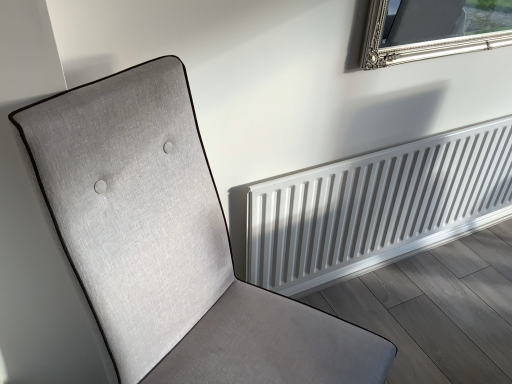
What do you see at coordinates (170, 245) in the screenshot?
I see `textured fabric chair at left` at bounding box center [170, 245].

This screenshot has height=384, width=512. Identify the location of textured fabric chair at left. (170, 245).

I want to click on white metallic radiator at lower right, so click(x=377, y=207).

Describe the element at coordinates (377, 207) in the screenshot. I see `white metallic radiator at lower right` at that location.

What are the coordinates of `textured fabric chair at left` in the screenshot? It's located at (170, 245).

Which is more to the left, white metallic radiator at lower right or textured fabric chair at left?

Positioned to the left is textured fabric chair at left.

Is white metallic radiator at lower right in front of or behind textured fabric chair at left in the image?

white metallic radiator at lower right is positioned farther from the viewer than textured fabric chair at left.

Considering the points (463, 161) and (234, 335), which point is behind, point (463, 161) or point (234, 335)?

The point (463, 161) is behind.

From the image's perspective, does white metallic radiator at lower right appear lower than textured fabric chair at left?

Incorrect, from the image's perspective, white metallic radiator at lower right is higher than textured fabric chair at left.

From a real-world perspective, is white metallic radiator at lower right positioned above or below textured fabric chair at left?

From a real-world perspective, white metallic radiator at lower right is physically below textured fabric chair at left.

Is white metallic radiator at lower right wider or thinner than textured fabric chair at left?

Clearly, white metallic radiator at lower right has less width compared to textured fabric chair at left.

In terms of height, does white metallic radiator at lower right look taller or shorter compared to textured fabric chair at left?

white metallic radiator at lower right is shorter than textured fabric chair at left.

In terms of size, does white metallic radiator at lower right appear bigger or smaller than textured fabric chair at left?

Clearly, white metallic radiator at lower right is smaller in size than textured fabric chair at left.

Would you say white metallic radiator at lower right is inside or outside textured fabric chair at left?

white metallic radiator at lower right is located beyond the bounds of textured fabric chair at left.

Is white metallic radiator at lower right beside textured fabric chair at left?

No, white metallic radiator at lower right is not in contact with textured fabric chair at left.

Is textured fabric chair at left at the back of white metallic radiator at lower right?

That's not correct — white metallic radiator at lower right is not looking away from textured fabric chair at left.

What's the angular difference between white metallic radiator at lower right and textured fabric chair at left's facing directions?

30.9 degrees separate the facing orientations of white metallic radiator at lower right and textured fabric chair at left.

Find the location of `furniture in front of the white metallic radiator at lower right`. furniture in front of the white metallic radiator at lower right is located at coordinates (170, 245).

Visually, is textured fabric chair at left positioned to the left or to the right of white metallic radiator at lower right?

textured fabric chair at left is positioned on white metallic radiator at lower right's left side.

Is textured fabric chair at left positioned before white metallic radiator at lower right?

Yes, it is in front of white metallic radiator at lower right.

Which is closer to the camera, [72,145] or [401,198]?

Point [72,145] is closer to the camera than point [401,198].

From the image's perspective, would you say textured fabric chair at left is positioned over white metallic radiator at lower right?

Incorrect, from the image's perspective, textured fabric chair at left is lower than white metallic radiator at lower right.

From a real-world perspective, is textured fabric chair at left positioned above or below white metallic radiator at lower right?

In terms of real-world spatial position, textured fabric chair at left is above white metallic radiator at lower right.

Considering the sizes of textured fabric chair at left and white metallic radiator at lower right in the image, is textured fabric chair at left wider or thinner than white metallic radiator at lower right?

textured fabric chair at left is wider than white metallic radiator at lower right.

Is textured fabric chair at left shorter than white metallic radiator at lower right?

No.

Does textured fabric chair at left have a larger size compared to white metallic radiator at lower right?

Indeed, textured fabric chair at left has a larger size compared to white metallic radiator at lower right.

Is white metallic radiator at lower right located within textured fabric chair at left?

Answer: No.

Is textured fabric chair at left placed right next to white metallic radiator at lower right?

No, textured fabric chair at left is not next to white metallic radiator at lower right.

Is textured fabric chair at left oriented towards white metallic radiator at lower right?

No, textured fabric chair at left is not aimed at white metallic radiator at lower right.

Identify the location of radiator on the right of textured fabric chair at left. click(377, 207).

Identify the location of furniture below the white metallic radiator at lower right (from the image's perspective). This screenshot has width=512, height=384. (170, 245).

This screenshot has width=512, height=384. Find the location of `radiator below the textured fabric chair at left (from a real-world perspective)`. radiator below the textured fabric chair at left (from a real-world perspective) is located at coordinates (377, 207).